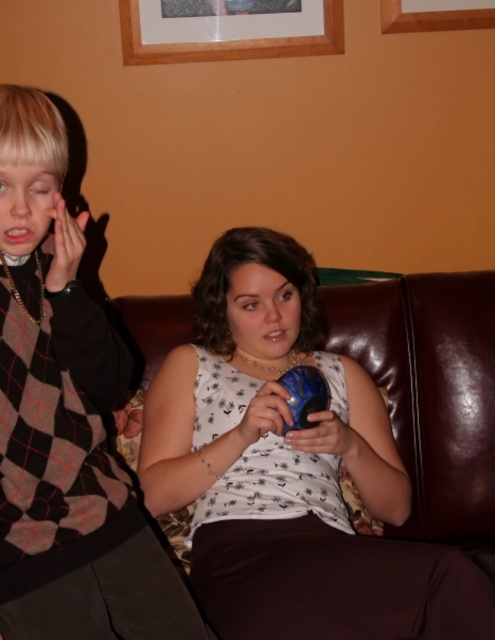
Is point (281, 616) behind point (270, 8)?

No, it is in front of (270, 8).

Does white fabric shirt at center have a greater width compared to wooden picture frame at upper center?

Incorrect, white fabric shirt at center's width does not surpass wooden picture frame at upper center's.

Where is `white fabric shirt at center`? This screenshot has width=495, height=640. white fabric shirt at center is located at coordinates (290, 470).

Can you confirm if checkered fabric sweater at left is positioned above wooden frame at upper center?

Incorrect, checkered fabric sweater at left is not positioned above wooden frame at upper center.

Is the position of checkered fabric sweater at left more distant than that of wooden frame at upper center?

No, it is not.

Between point (118, 525) and point (411, 19), which one is positioned behind?

The point (411, 19) is behind.

Locate an element on the screen. The image size is (495, 640). checkered fabric sweater at left is located at coordinates (64, 420).

Is point (308, 49) farther from camera compared to point (482, 19)?

Yes, it is.

Does wooden picture frame at upper center have a greater width compared to wooden frame at upper center?

Yes, wooden picture frame at upper center is wider than wooden frame at upper center.

Measure the distance between wooden picture frame at upper center and camera.

wooden picture frame at upper center is 6.25 feet from camera.

Image resolution: width=495 pixels, height=640 pixels. I want to click on wooden picture frame at upper center, so click(228, 29).